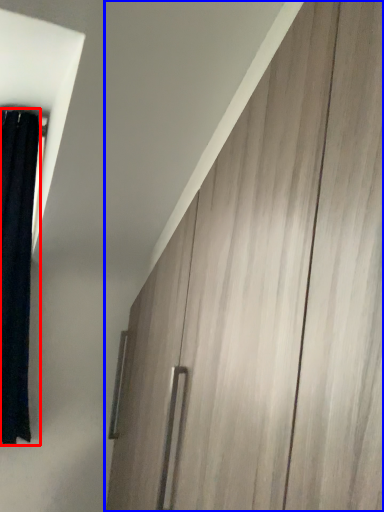
Question: Which of the following is the closest to the observer, curtain (highlighted by a red box) or barn door (highlighted by a blue box)?

Choices:
 (A) curtain
 (B) barn door

Answer: (B)